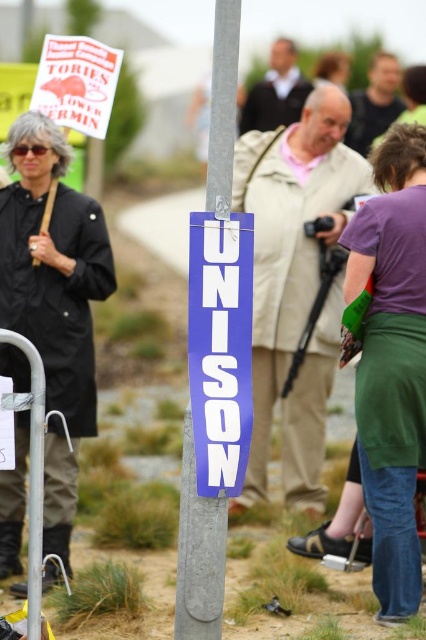
You are a photographer trying to capture a photo of the UNISON sign and both the black matte coat at left and purple fabric skirt at lower right. Based on their positions, which object is closer to the camera?

The black matte coat at left is closer to the camera than the purple fabric skirt at lower right because it is positioned in the foreground.

You are a photographer trying to capture a clear shot of the metallic gray pole at center without any obstruction from the black matte coat at left. Based on their positions, is this possible?

The black matte coat at left is to the left of the metallic gray pole at center, so if you position yourself to the right side of the pole, you can capture the pole without the coat obstructing the view.

You are an observer looking at the scene described. You need to locate the purple fabric skirt at lower right. Where exactly is it located in the image?

The purple fabric skirt at lower right is located at point (391, 362) in the image.